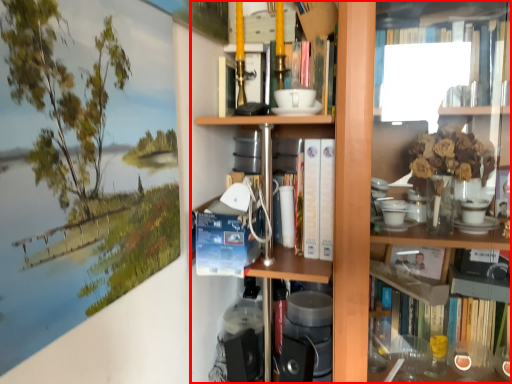
Question: From the image's perspective, what is the correct spatial positioning of bookcase (annotated by the red box) in reference to book?

Choices:
 (A) above
 (B) below

Answer: (B)